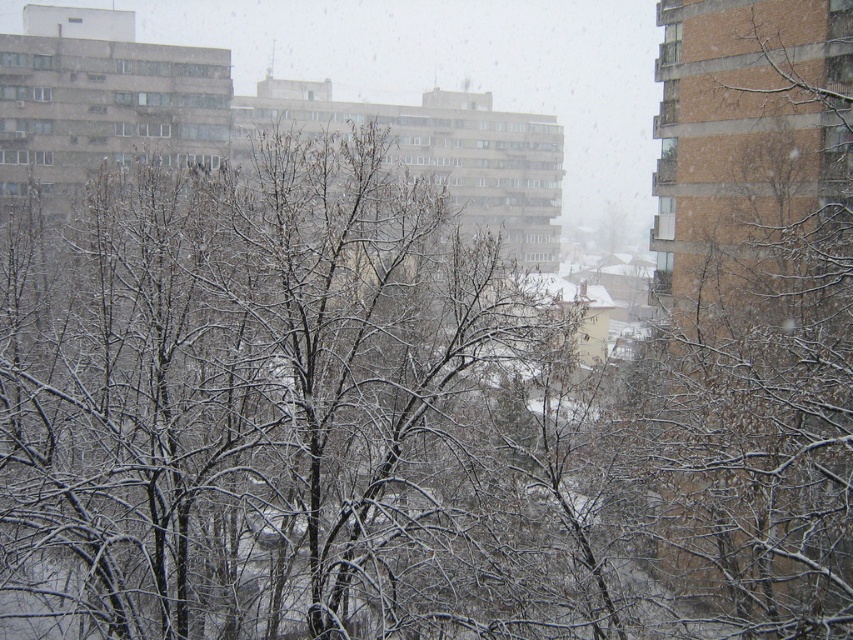
You are standing in the winter scene and want to take a photo of both the point at coordinates point [734,291] and point [49,64]. Which point will appear larger in your photo?

Point [734,291] is closer to the camera than point [49,64], so it will appear larger in the photo.